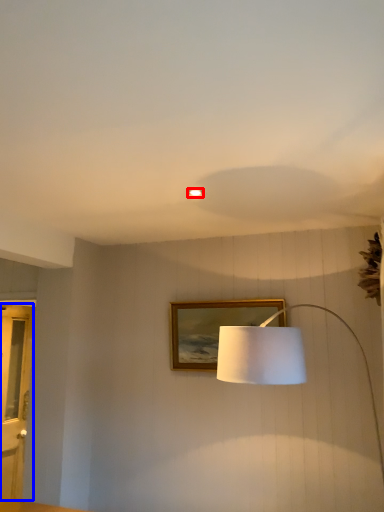
Question: Which point is further to the camera, lighting (highlighted by a red box) or glass door (highlighted by a blue box)?

Choices:
 (A) lighting
 (B) glass door

Answer: (B)